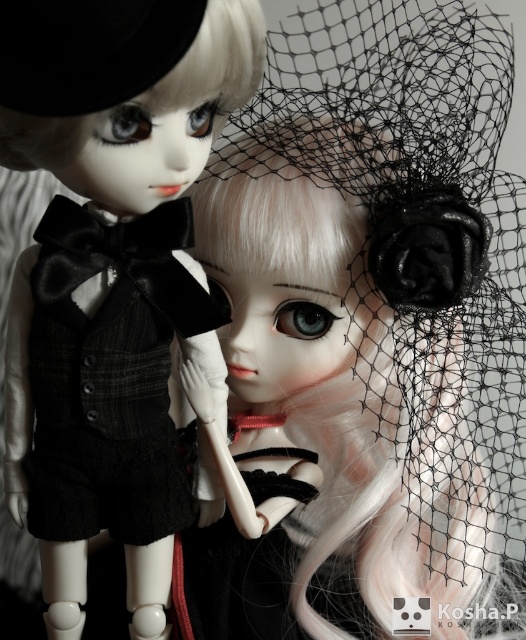
Question: Is satin black doll at center wider than black velvet hat at upper left?

Choices:
 (A) no
 (B) yes

Answer: (B)

Question: Which object is closer to the camera taking this photo?

Choices:
 (A) velvet black vest at left
 (B) satin black doll at center
 (C) matte black veil at upper right

Answer: (C)

Question: Is satin black doll at center smaller than black velvet hat at upper left?

Choices:
 (A) yes
 (B) no

Answer: (B)

Question: Which point is closer to the camera?

Choices:
 (A) (246, 125)
 (B) (188, 36)

Answer: (B)

Question: Which of these objects is positioned closest to the velvet black vest at left?

Choices:
 (A) matte black veil at upper right
 (B) black velvet hat at upper left
 (C) satin black doll at center

Answer: (A)

Question: Can you confirm if satin black doll at center is positioned to the right of velvet black vest at left?

Choices:
 (A) yes
 (B) no

Answer: (A)